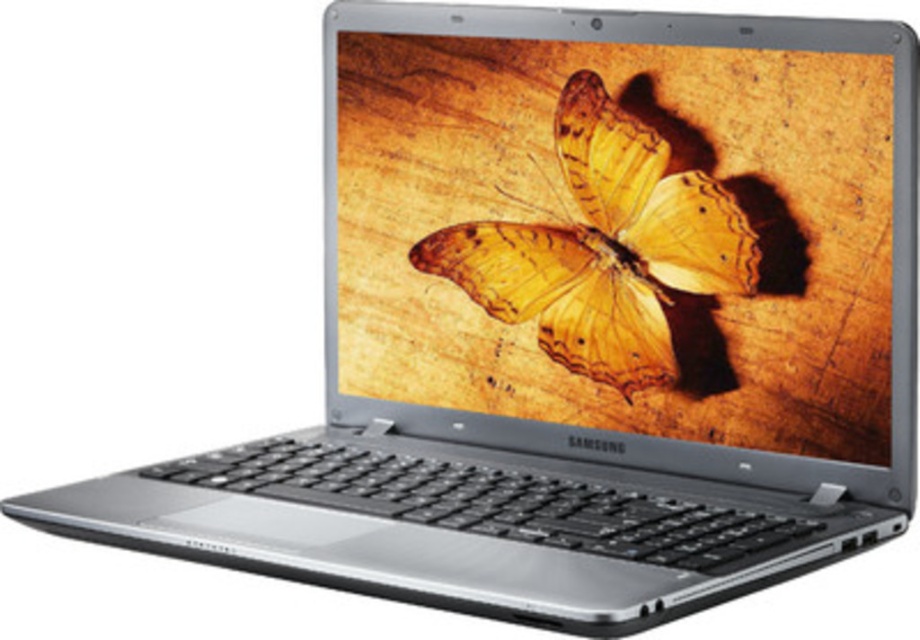
Question: Which object appears farthest from the camera in this image?

Choices:
 (A) metallic silver laptop at center
 (B) yellow translucent wings at center

Answer: (B)

Question: Can you confirm if metallic silver laptop at center is smaller than yellow translucent wings at center?

Choices:
 (A) yes
 (B) no

Answer: (B)

Question: Is metallic silver laptop at center in front of yellow translucent wings at center?

Choices:
 (A) no
 (B) yes

Answer: (B)

Question: Where is metallic silver laptop at center located in relation to yellow translucent wings at center in the image?

Choices:
 (A) below
 (B) above

Answer: (B)